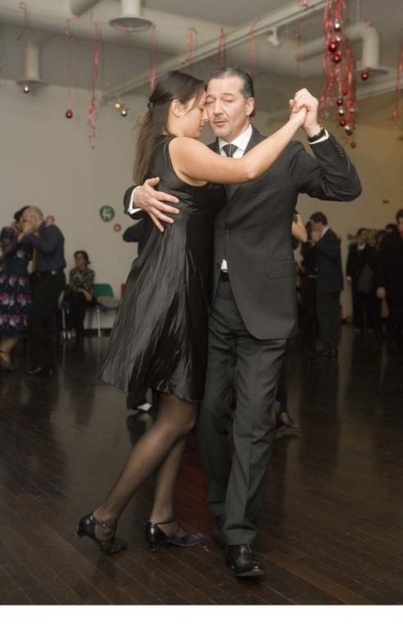
In the scene shown: Can you confirm if shiny black dress at left is shorter than satin black dress at lower left?

No, shiny black dress at left is not shorter than satin black dress at lower left.

Between shiny black dress at left and satin black dress at lower left, which one is positioned lower?

Positioned lower is shiny black dress at left.

Identify the location of shiny black dress at left. Image resolution: width=403 pixels, height=640 pixels. (12, 285).

Locate an element on the screen. shiny black dress at left is located at coordinates (12, 285).

Is dark gray suit at center wider than satin black dress at lower left?

No.

Which is above, dark gray suit at center or satin black dress at lower left?

dark gray suit at center

Between point (319, 241) and point (64, 304), which one is positioned behind?

The point (64, 304) is more distant.

Find the location of `dark gray suit at center`. dark gray suit at center is located at coordinates (324, 278).

Looking at this image, who is higher up, dark gray suit at center or shiny black dress at left?

dark gray suit at center

Based on the photo, measure the distance between dark gray suit at center and camera.

dark gray suit at center is 7.36 meters from camera.

Find the location of `dark gray suit at center`. dark gray suit at center is located at coordinates (324, 278).